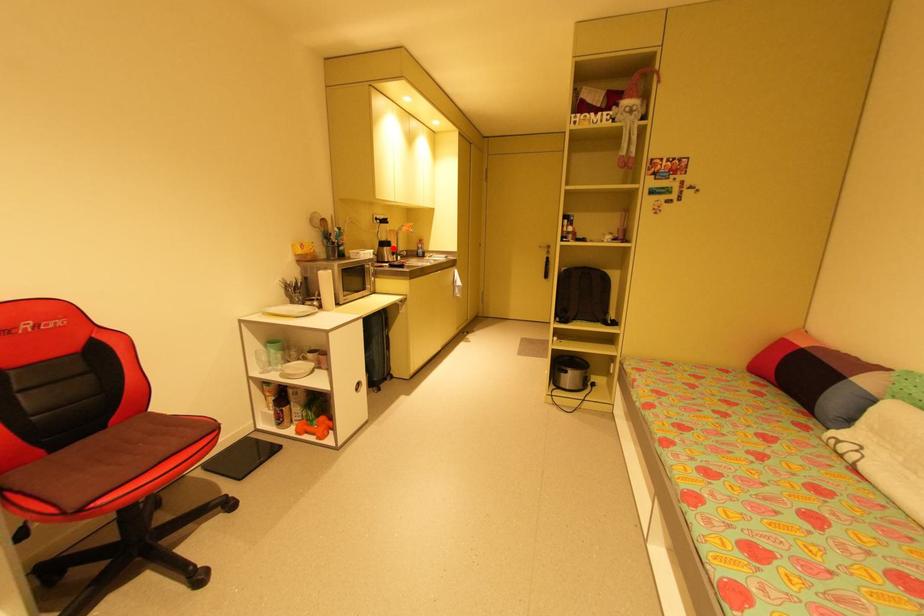
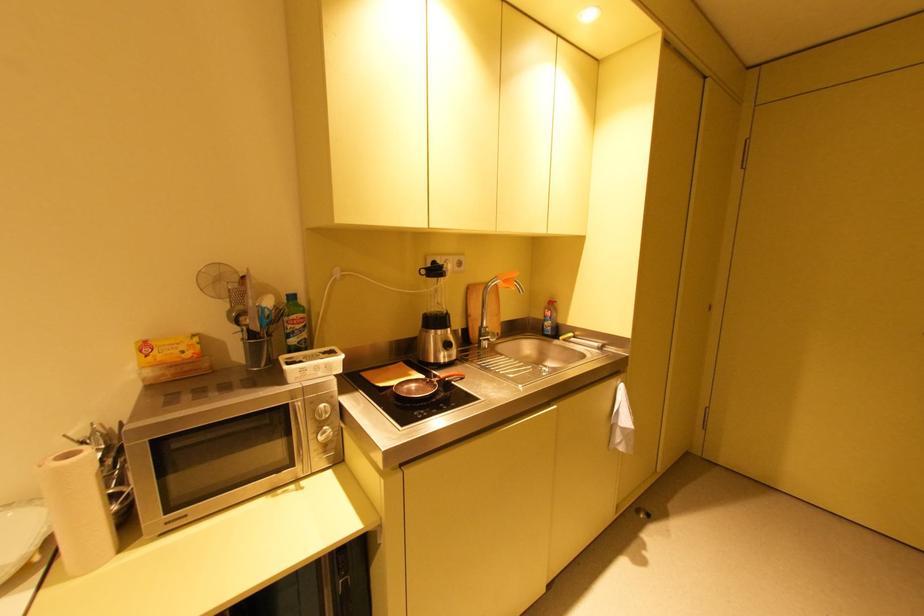
Where in the second image is the point corresponding to the highlighted location from the first image?

(444, 331)